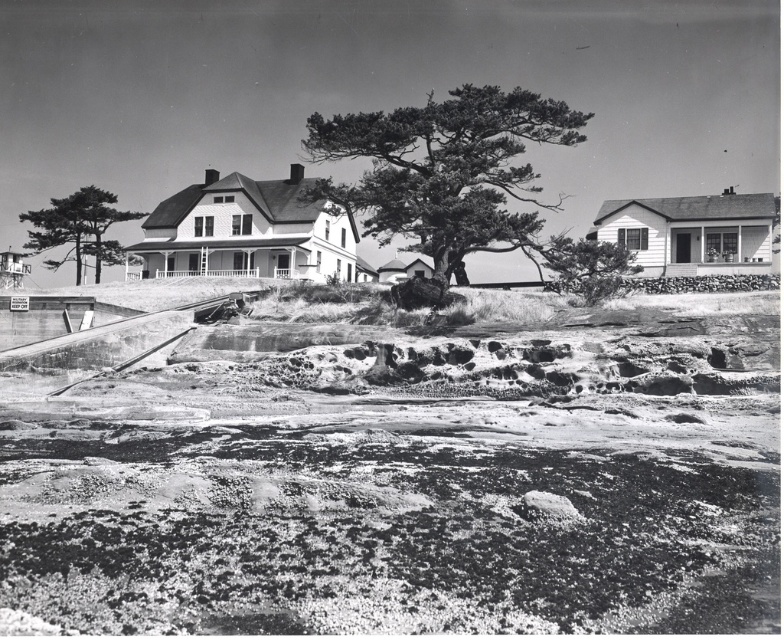
In the scene shown: You are standing on the rugged, rocky shoreline in the foreground of the coastal scene. You want to climb up to the house on the raised area. Which object, the rocky terrain at lower center or the smooth bark tree at left, would be a better foothold for your climb?

The rocky terrain at lower center is not as tall as the smooth bark tree at left, so the smooth bark tree at left would provide a better foothold for climbing up to the house.

You are standing on the rugged rocky shoreline looking towards the large two story house. You notice two trees at center. Which tree is closer to you, the scaly bark tree at center or the smooth bark tree at center?

The scaly bark tree at center is closer to you because the smooth bark tree at center is behind it.